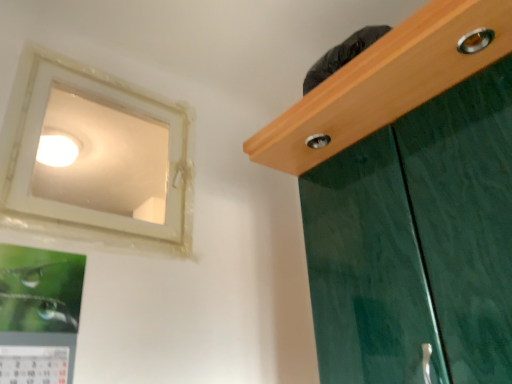
Question: From a real-world perspective, is metallic silver picture frame at lower left positioned over white plastic window at upper left based on gravity?

Choices:
 (A) no
 (B) yes

Answer: (A)

Question: Is the position of metallic silver picture frame at lower left less distant than that of white plastic window at upper left?

Choices:
 (A) no
 (B) yes

Answer: (B)

Question: Can you confirm if metallic silver picture frame at lower left is shorter than white plastic window at upper left?

Choices:
 (A) no
 (B) yes

Answer: (B)

Question: Is metallic silver picture frame at lower left located outside white plastic window at upper left?

Choices:
 (A) yes
 (B) no

Answer: (A)

Question: Is metallic silver picture frame at lower left thinner than white plastic window at upper left?

Choices:
 (A) no
 (B) yes

Answer: (A)

Question: From the image's perspective, does metallic silver picture frame at lower left appear lower than white plastic window at upper left?

Choices:
 (A) no
 (B) yes

Answer: (B)

Question: Considering the relative sizes of white glossy light fixture at upper left and metallic silver picture frame at lower left in the image provided, is white glossy light fixture at upper left bigger than metallic silver picture frame at lower left?

Choices:
 (A) no
 (B) yes

Answer: (A)

Question: Is white glossy light fixture at upper left shorter than metallic silver picture frame at lower left?

Choices:
 (A) no
 (B) yes

Answer: (B)

Question: Is white glossy light fixture at upper left in contact with metallic silver picture frame at lower left?

Choices:
 (A) yes
 (B) no

Answer: (B)

Question: Is white glossy light fixture at upper left facing away from metallic silver picture frame at lower left?

Choices:
 (A) no
 (B) yes

Answer: (A)

Question: Is white glossy light fixture at upper left far away from metallic silver picture frame at lower left?

Choices:
 (A) no
 (B) yes

Answer: (B)

Question: Could you tell me if white glossy light fixture at upper left is turned towards metallic silver picture frame at lower left?

Choices:
 (A) yes
 (B) no

Answer: (B)

Question: From the image's perspective, is white plastic window at upper left located above metallic silver picture frame at lower left?

Choices:
 (A) no
 (B) yes

Answer: (B)